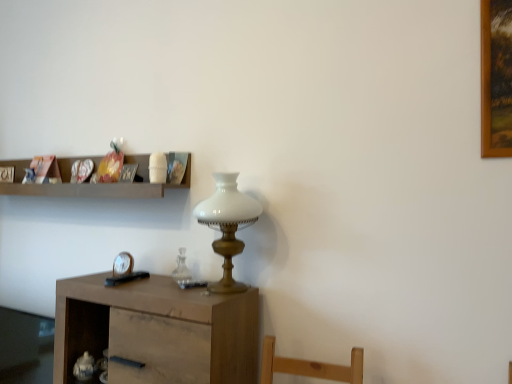
Question: Is metallic silver clock at lower left facing towards metallic silver picture frame at upper center, positioned as the first picture frame in front-to-back order?

Choices:
 (A) yes
 (B) no

Answer: (B)

Question: Is metallic silver clock at lower left directly adjacent to metallic silver picture frame at upper center, positioned as the second picture frame in left-to-right order?

Choices:
 (A) yes
 (B) no

Answer: (B)

Question: Can you confirm if metallic silver clock at lower left is shorter than metallic silver picture frame at upper center, positioned as the first picture frame in front-to-back order?

Choices:
 (A) yes
 (B) no

Answer: (A)

Question: Can we say metallic silver clock at lower left lies outside metallic silver picture frame at upper center, positioned as the second picture frame in left-to-right order?

Choices:
 (A) no
 (B) yes

Answer: (B)

Question: From a real-world perspective, is metallic silver clock at lower left under metallic silver picture frame at upper center, positioned as the second picture frame in left-to-right order?

Choices:
 (A) no
 (B) yes

Answer: (B)

Question: Relative to wooden cabinet at center, is metallic silver picture frame at upper center, which appears as the first picture frame when viewed from the right, in front or behind?

Choices:
 (A) front
 (B) behind

Answer: (B)

Question: Is metallic silver picture frame at upper center, which is the 2th picture frame from back to front, inside the boundaries of wooden cabinet at center, or outside?

Choices:
 (A) outside
 (B) inside

Answer: (A)

Question: Is point (121, 173) closer or farther from the camera than point (162, 327)?

Choices:
 (A) farther
 (B) closer

Answer: (A)

Question: From a real-world perspective, is metallic silver picture frame at upper center, positioned as the first picture frame in front-to-back order, above or below wooden cabinet at center?

Choices:
 (A) above
 (B) below

Answer: (A)

Question: Looking at their shapes, would you say metallic silver picture frame at upper center, which is the 2th picture frame from back to front, is wider or thinner than clear glass vase at center?

Choices:
 (A) thin
 (B) wide

Answer: (A)

Question: Would you say metallic silver picture frame at upper center, which is the 2th picture frame from back to front, is to the left or to the right of clear glass vase at center in the picture?

Choices:
 (A) right
 (B) left

Answer: (B)

Question: Is metallic silver picture frame at upper center, positioned as the second picture frame in left-to-right order, in front of or behind clear glass vase at center in the image?

Choices:
 (A) behind
 (B) front

Answer: (A)

Question: Is metallic silver picture frame at upper center, positioned as the first picture frame in front-to-back order, taller or shorter than clear glass vase at center?

Choices:
 (A) tall
 (B) short

Answer: (B)

Question: Is wooden cabinet at center inside or outside of wooden shelf at upper center?

Choices:
 (A) inside
 (B) outside

Answer: (B)

Question: Is wooden cabinet at center taller or shorter than wooden shelf at upper center?

Choices:
 (A) tall
 (B) short

Answer: (A)